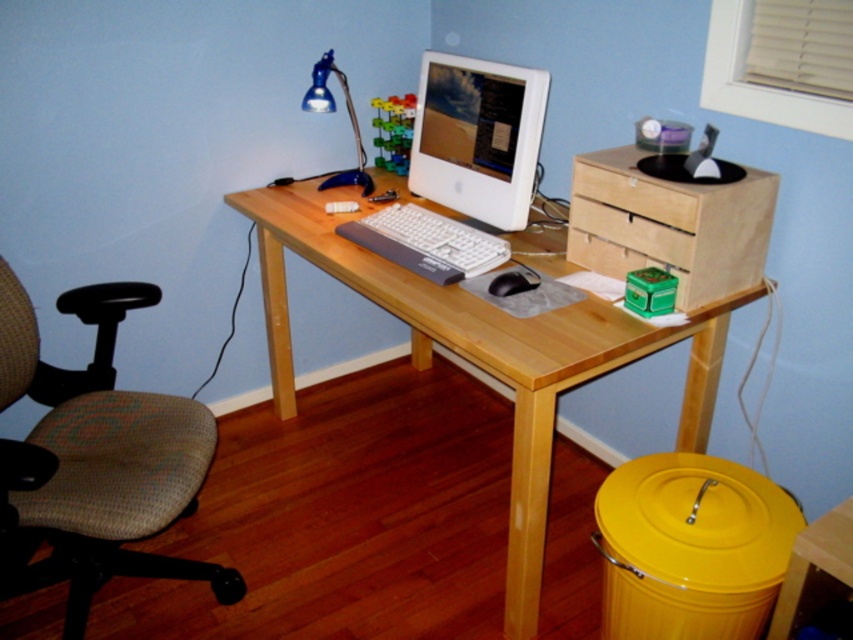
Who is positioned more to the left, natural wood computer desk at center or birch wood drawer at right?

Positioned to the left is natural wood computer desk at center.

Is natural wood computer desk at center to the right of birch wood drawer at right from the viewer's perspective?

Incorrect, natural wood computer desk at center is not on the right side of birch wood drawer at right.

Does point (531, 490) come closer to viewer compared to point (595, 221)?

Yes.

This screenshot has height=640, width=853. I want to click on natural wood computer desk at center, so (485, 353).

Who is taller, natural wood computer desk at center or white glossy computer monitor at upper center?

Standing taller between the two is natural wood computer desk at center.

Which is below, natural wood computer desk at center or white glossy computer monitor at upper center?

natural wood computer desk at center is lower down.

This screenshot has width=853, height=640. I want to click on natural wood computer desk at center, so click(x=485, y=353).

The width and height of the screenshot is (853, 640). What are the coordinates of `natural wood computer desk at center` in the screenshot? It's located at (485, 353).

Does natural wood computer desk at center appear on the left side of black matte mouse at center?

Yes, natural wood computer desk at center is to the left of black matte mouse at center.

Does point (527, 580) come behind point (506, 276)?

No.

What are the coordinates of `natural wood computer desk at center` in the screenshot? It's located at (485, 353).